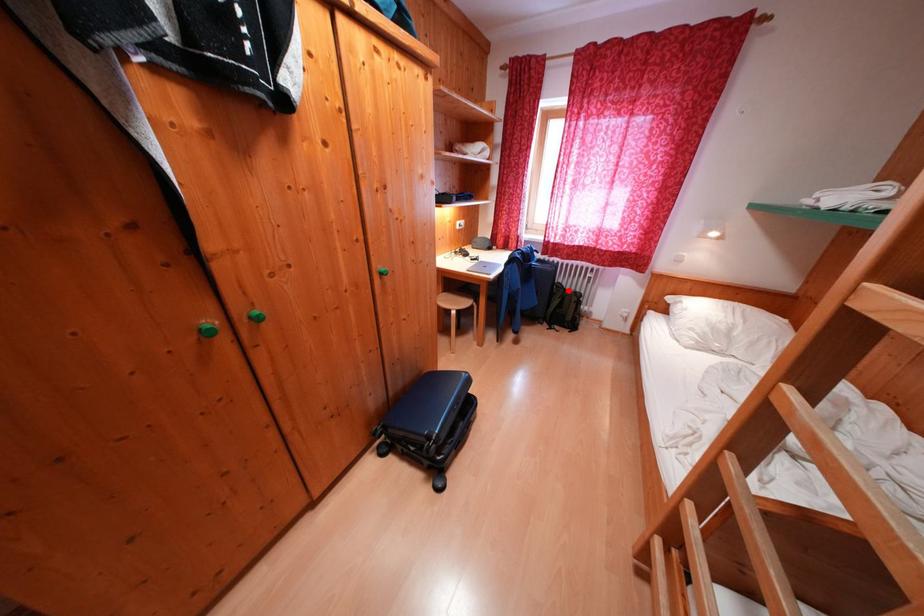
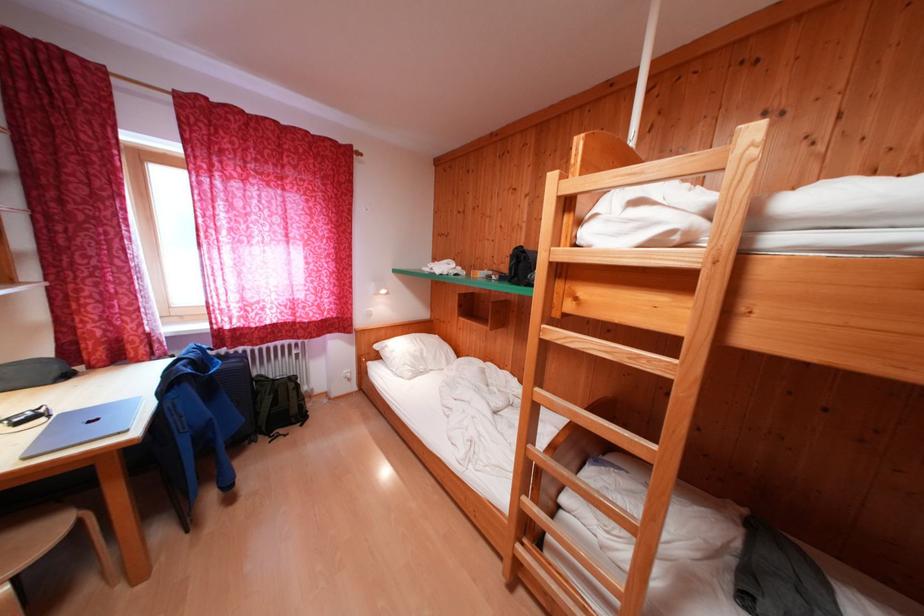
Where in the second image is the point corresponding to the highlighted location from the first image?

(271, 383)